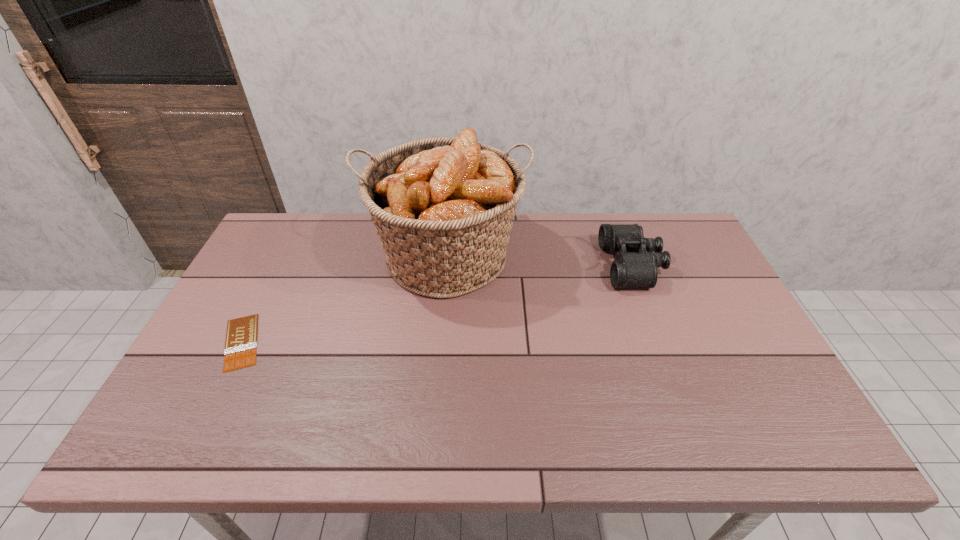
Find the location of a particular element. This screenshot has height=540, width=960. vacant area located on the right of the nearest object is located at coordinates (357, 342).

Identify the location of basket that is positioned at the far edge. (443, 208).

The height and width of the screenshot is (540, 960). Find the location of `binoculars present at the far edge`. binoculars present at the far edge is located at coordinates (635, 265).

You are a GUI agent. You are given a task and a screenshot of the screen. Output one action in this format:
    pyautogui.click(x=<x>, y=<y>)
    Task: Click on the object that is at the left edge
    The image size is (960, 540).
    Given the screenshot: What is the action you would take?
    pyautogui.click(x=240, y=351)

This screenshot has height=540, width=960. I want to click on object that is positioned at the right edge, so click(x=635, y=265).

Locate an element on the screen. object that is at the far right corner is located at coordinates (635, 265).

In order to click on vacant space at the far edge of the desktop in this screenshot , I will do `click(536, 237)`.

In the image, there is a desktop. What are the coordinates of `free space at the near edge` in the screenshot? It's located at click(393, 446).

This screenshot has height=540, width=960. In order to click on vacant space at the far right corner of the desktop in this screenshot , I will do `click(691, 233)`.

Locate an element on the screen. Image resolution: width=960 pixels, height=540 pixels. blank space at the near right corner is located at coordinates (739, 422).